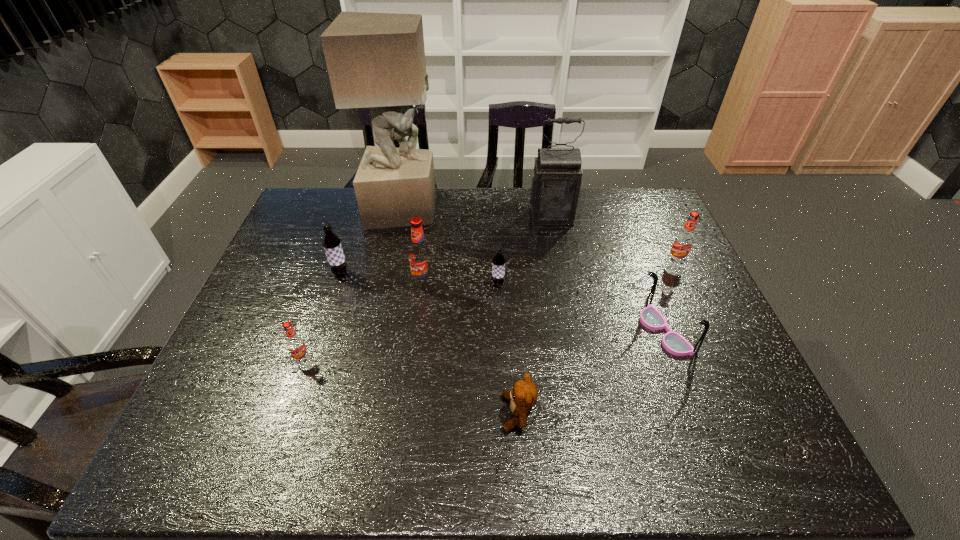
You are a GUI agent. You are given a task and a screenshot of the screen. Output one action in this format:
    pyautogui.click(x=<x>, y=<y>)
    Task: Click on the sculpture
    This screenshot has height=540, width=960.
    Given the screenshot: What is the action you would take?
    pyautogui.click(x=374, y=60)

Identify the location of gray sculpture. This screenshot has width=960, height=540. (374, 60).

Identify the location of the eighth shortest object. (556, 182).

Where is `the seventh object from left to right`? the seventh object from left to right is located at coordinates (556, 182).

At what (x,y) coordinates should I click in order to perform the action: click on the third root beer from left to right. Please return your answer as a coordinate pair (x, y). Looking at the image, I should click on (420, 258).

You are a GUI agent. You are given a task and a screenshot of the screen. Output one action in this format:
    pyautogui.click(x=<x>, y=<y>)
    Task: Click on the seventh shortest object
    This screenshot has height=540, width=960.
    Given the screenshot: What is the action you would take?
    pyautogui.click(x=420, y=258)

The width and height of the screenshot is (960, 540). In order to click on the farthest red root beer in this screenshot , I will do `click(683, 242)`.

Locate an element on the screen. The height and width of the screenshot is (540, 960). the second smallest red root beer is located at coordinates [x=683, y=242].

Find the location of a particular element. the left brown root beer is located at coordinates (331, 242).

Locate an element on the screen. This screenshot has width=960, height=540. pink spectacles is located at coordinates (650, 317).